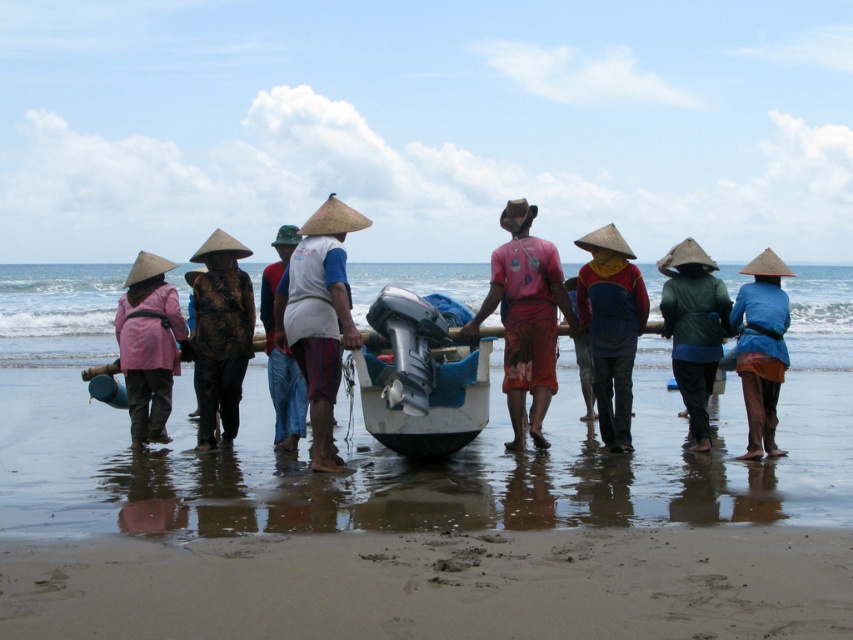
You are a photographer trying to capture the scene of the textured brown jacket at center and the blue fabric hat at center. Which object should you focus on first if you want to ensure both are in focus, considering their sizes?

The textured brown jacket at center is thinner than the blue fabric hat at center, so you should focus on the blue fabric hat at center first as it is larger and requires more precise focusing to ensure both are in focus.

You are a photographer trying to capture a clear photo of the white fabric shirt at center without the blue fabric hat at center blocking it. What should you do?

Move the camera position forward to get closer to the white fabric shirt at center so that it moves in front of the blue fabric hat at center, or adjust the angle to frame the white fabric shirt at center in a way that avoids the blue fabric hat at center blocking it.

In the scene shown: You are standing at the camera position and want to throw a ball to a friend who is at point (749, 292). There is an obstacle at point (426, 339). Will the ball pass over the obstacle?

Point (426, 339) is closer to the camera than point (749, 292), so the ball will hit the obstacle at point (426, 339) before reaching your friend.